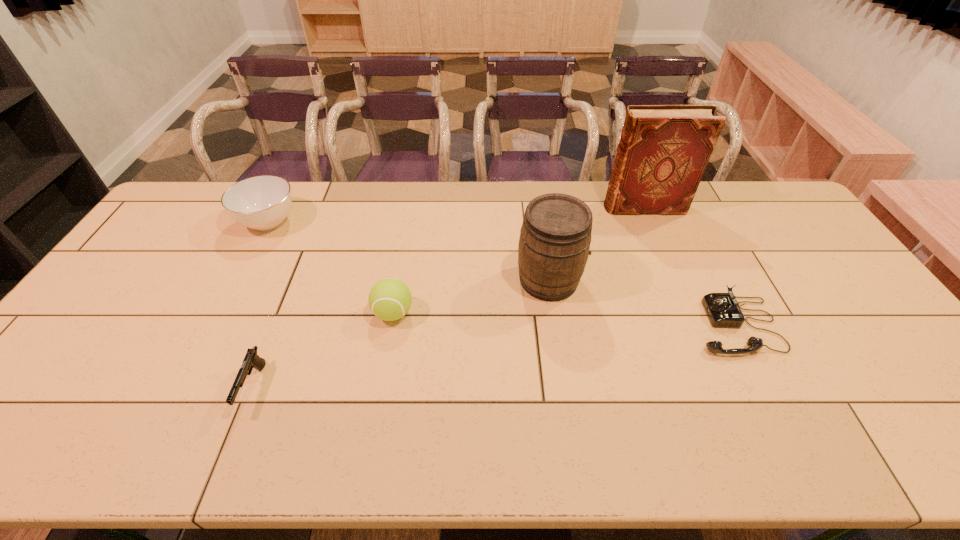
Identify the location of blank area at the far edge. (421, 214).

In the image, there is a desktop. Where is `free space at the near edge`? free space at the near edge is located at coordinates [x=560, y=438].

This screenshot has height=540, width=960. Identify the location of vacant area at the right edge. (784, 239).

I want to click on free space at the far left corner of the desktop, so (x=184, y=191).

Identify the location of vacant space in between the third object from right to left and the telephone. (642, 303).

At what (x,y) coordinates should I click in order to perform the action: click on free space between the chinaware and the telephone. Please return your answer as a coordinate pair (x, y). Image resolution: width=960 pixels, height=540 pixels. Looking at the image, I should click on (502, 274).

Find the location of `vacant region between the fourth object from right to left and the fifth object from right to left`. vacant region between the fourth object from right to left and the fifth object from right to left is located at coordinates (324, 350).

Find the location of a particular element. empty space between the second tallest object and the hardback book is located at coordinates (596, 244).

Where is `blank region between the hardback book and the nearest object`? blank region between the hardback book and the nearest object is located at coordinates (448, 297).

Where is `vacant area that lies between the telephone and the third object from left to right`? vacant area that lies between the telephone and the third object from left to right is located at coordinates (564, 319).